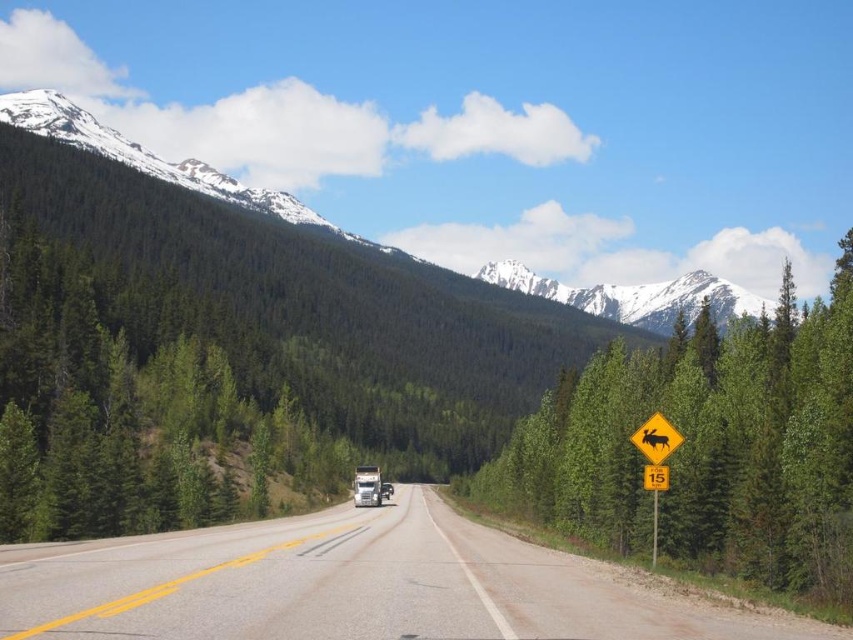
From the picture: You are a delivery driver currently located at the camera position. Your GPS says you need to stop your truck at the exact location of the brushed metal trailer truck at center. If your truck requires 120 meters to safely come to a stop, will you be able to stop in time?

The distance between the brushed metal trailer truck at center and the camera is 115.58 meters. Since the required stopping distance is 120 meters, you will not be able to stop in time as the available distance is shorter than needed.